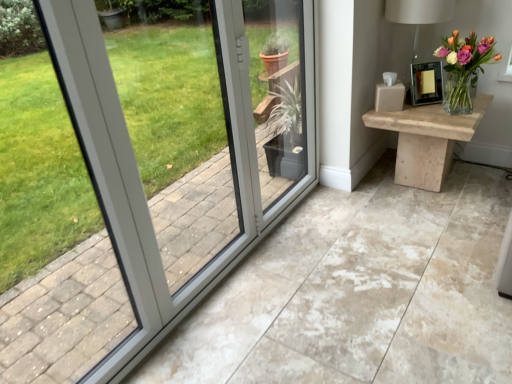
In the scene shown: Measure the distance between natural wood table at right and camera.

The depth of natural wood table at right is 2.30 meters.

The width and height of the screenshot is (512, 384). I want to click on clear glass vase at upper right, so click(464, 68).

Between clear glass vase at upper right and natural wood table at right, which one appears on the left side from the viewer's perspective?

Positioned to the left is natural wood table at right.

Considering the sizes of clear glass vase at upper right and natural wood table at right in the image, is clear glass vase at upper right wider or thinner than natural wood table at right?

Clearly, clear glass vase at upper right has less width compared to natural wood table at right.

Where is `table on the left of the clear glass vase at upper right`? table on the left of the clear glass vase at upper right is located at coordinates pos(426,139).

Measure the distance from clear glass vase at upper right to natural wood table at right.

A distance of 9.92 inches exists between clear glass vase at upper right and natural wood table at right.

From the image's perspective, who appears lower, matte white table lamp at upper right or natural wood table at right?

natural wood table at right, from the image's perspective.

Locate an element on the screen. table lamp lying on the left of natural wood table at right is located at coordinates (419, 14).

Could you tell me if matte white table lamp at upper right is facing natural wood table at right?

No, matte white table lamp at upper right is not facing towards natural wood table at right.

The image size is (512, 384). I want to click on table lamp above the natural wood table at right (from the image's perspective), so click(x=419, y=14).

Is natural wood table at right positioned far away from matte white table lamp at upper right?

They are positioned close to each other.

Can you confirm if natural wood table at right is bigger than matte white table lamp at upper right?

Yes, natural wood table at right is bigger than matte white table lamp at upper right.

From the image's perspective, between matte white table lamp at upper right and clear glass vase at upper right, who is located below?

clear glass vase at upper right appears lower in the image.

Between matte white table lamp at upper right and clear glass vase at upper right, which one has more height?

matte white table lamp at upper right.

Can you confirm if matte white table lamp at upper right is wider than clear glass vase at upper right?

Yes.

Is matte white table lamp at upper right not near clear glass vase at upper right?

Actually, matte white table lamp at upper right and clear glass vase at upper right are a little close together.

From a real-world perspective, is natural wood table at right located higher than clear glass vase at upper right?

Incorrect, from a real-world perspective, natural wood table at right is lower than clear glass vase at upper right.

What's the angular difference between natural wood table at right and clear glass vase at upper right's facing directions?

The angle between the facing direction of natural wood table at right and the facing direction of clear glass vase at upper right is 0.00275 degrees.

Who is smaller, natural wood table at right or clear glass vase at upper right?

clear glass vase at upper right.

Does clear glass vase at upper right come behind matte white table lamp at upper right?

No, clear glass vase at upper right is in front of matte white table lamp at upper right.

Does clear glass vase at upper right turn towards matte white table lamp at upper right?

No, clear glass vase at upper right is not aimed at matte white table lamp at upper right.

In order to click on houseplant to the right of matte white table lamp at upper right in this screenshot , I will do `click(464, 68)`.

Is matte white table lamp at upper right surrounded by clear glass vase at upper right?

No, matte white table lamp at upper right is not inside clear glass vase at upper right.

Where is `houseplant above the natural wood table at right (from a real-world perspective)`? The width and height of the screenshot is (512, 384). houseplant above the natural wood table at right (from a real-world perspective) is located at coordinates (464, 68).

Where is `table lamp above the natural wood table at right (from the image's perspective)`? The image size is (512, 384). table lamp above the natural wood table at right (from the image's perspective) is located at coordinates (419, 14).

Based on their spatial positions, is clear glass vase at upper right or natural wood table at right further from matte white table lamp at upper right?

Among the two, natural wood table at right is located further to matte white table lamp at upper right.

From the image, which object appears to be nearer to matte white table lamp at upper right, natural wood table at right or clear glass vase at upper right?

The object closer to matte white table lamp at upper right is clear glass vase at upper right.

Considering their positions, is matte white table lamp at upper right positioned further to natural wood table at right than clear glass vase at upper right?

Among the two, matte white table lamp at upper right is located further to natural wood table at right.

Based on the photo, estimate the real-world distances between objects in this image. Which object is further from clear glass vase at upper right, matte white table lamp at upper right or natural wood table at right?

matte white table lamp at upper right is further to clear glass vase at upper right.

From the image, which object appears to be nearer to natural wood table at right, clear glass vase at upper right or matte white table lamp at upper right?

Based on the image, clear glass vase at upper right appears to be nearer to natural wood table at right.

Consider the image. When comparing their distances from clear glass vase at upper right, does natural wood table at right or matte white table lamp at upper right seem further?

The object further to clear glass vase at upper right is matte white table lamp at upper right.

Find the location of a particular element. This screenshot has height=384, width=512. houseplant between matte white table lamp at upper right and natural wood table at right in the up-down direction is located at coordinates (464, 68).